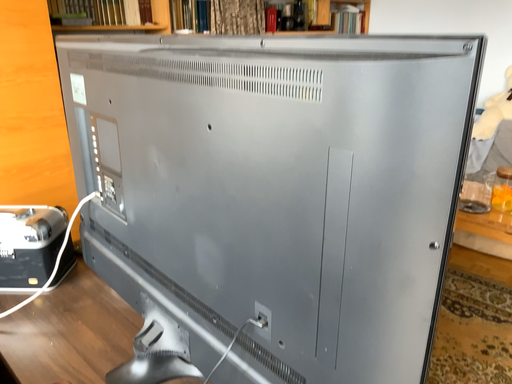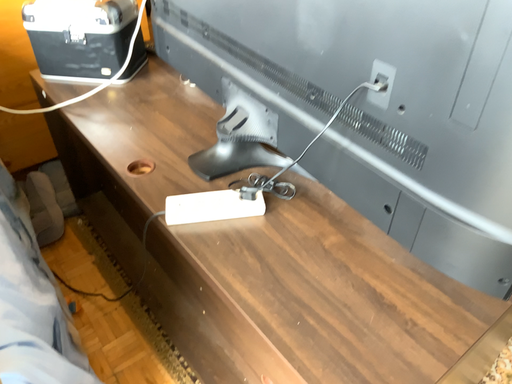
Question: How did the camera likely rotate when shooting the video?

Choices:
 (A) rotated right
 (B) rotated left

Answer: (B)